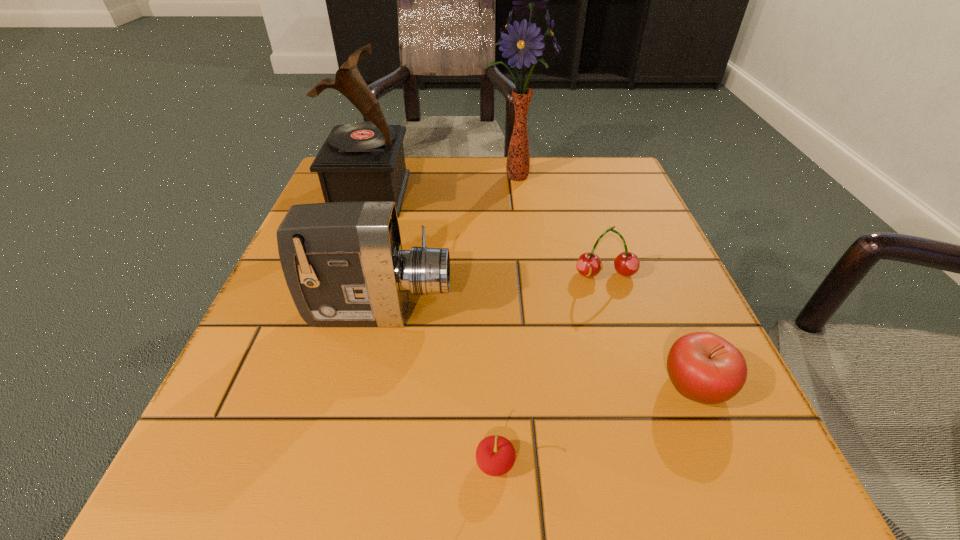
Identify the location of vacant space that satisfies the following two spatial constraints: 1. on the back side of the apple; 2. at the front of the camcorder, highlighting the lens. This screenshot has height=540, width=960. (664, 312).

Find the location of a particular element. blank space that satisfies the following two spatial constraints: 1. at the horn opening of the apple; 2. on the right side of the second tallest object is located at coordinates (303, 386).

Locate an element on the screen. The image size is (960, 540). vacant space that satisfies the following two spatial constraints: 1. on the front side of the tallest object; 2. at the horn opening of the phonograph_record is located at coordinates (517, 194).

Where is `vacant space that satisfies the following two spatial constraints: 1. at the horn opening of the nearer cherry; 2. on the right side of the second tallest object`? This screenshot has width=960, height=540. vacant space that satisfies the following two spatial constraints: 1. at the horn opening of the nearer cherry; 2. on the right side of the second tallest object is located at coordinates (276, 464).

The height and width of the screenshot is (540, 960). Find the location of `free space in the image that satisfies the following two spatial constraints: 1. at the front of the camcorder, highlighting the lens; 2. on the back side of the nearest object`. free space in the image that satisfies the following two spatial constraints: 1. at the front of the camcorder, highlighting the lens; 2. on the back side of the nearest object is located at coordinates (344, 464).

Identify the location of free space that satisfies the following two spatial constraints: 1. at the horn opening of the nearest object; 2. on the left side of the phonograph_record. (276, 464).